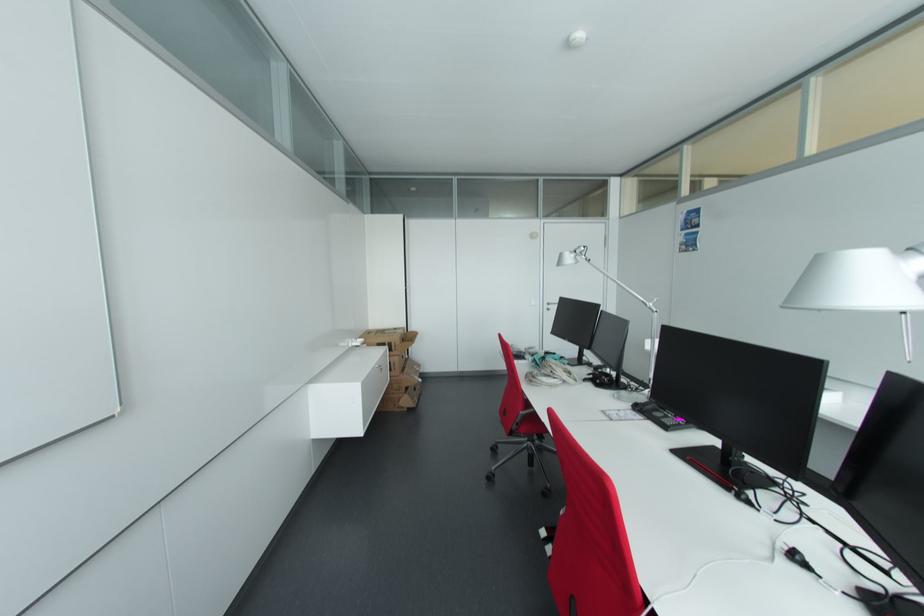
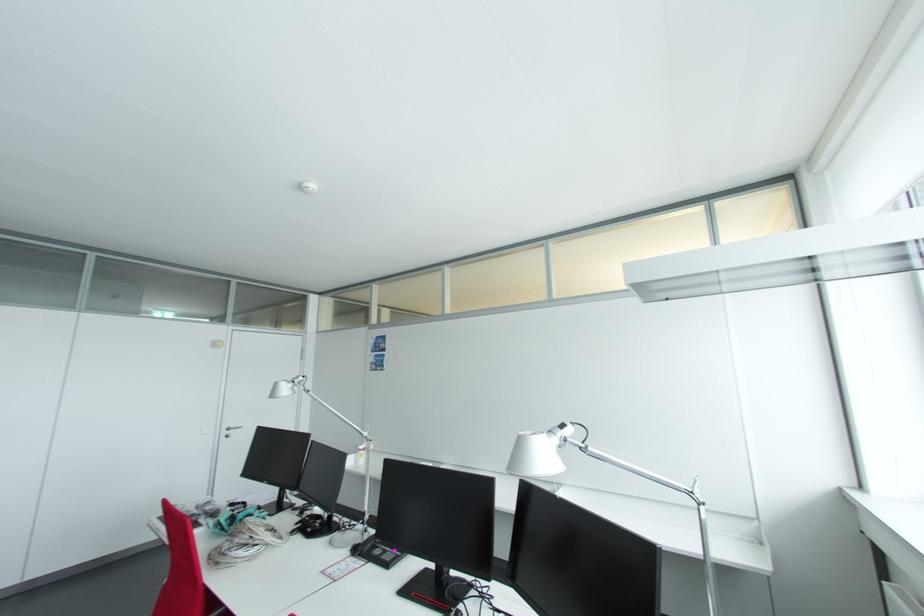
Find the pixel in the second image that matches pixel 578 254 in the first image.

(295, 385)